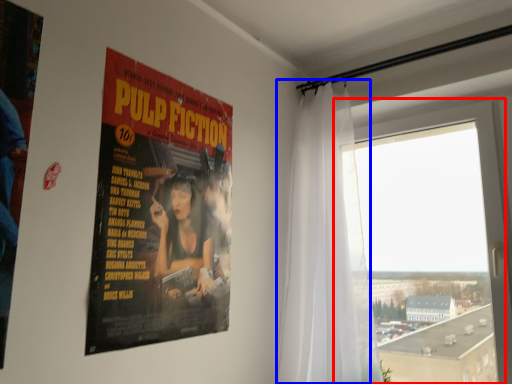
Question: Which object appears farthest to the camera in this image, window (highlighted by a red box) or curtain (highlighted by a blue box)?

Choices:
 (A) window
 (B) curtain

Answer: (A)